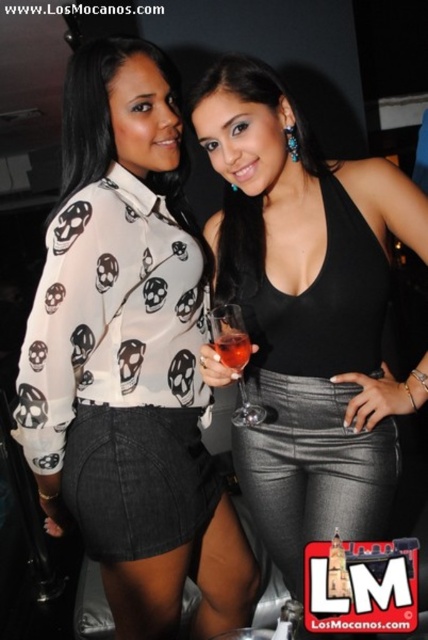
Can you confirm if white sheer blouse at upper left is smaller than shiny silver pants at center?

No, white sheer blouse at upper left is not smaller than shiny silver pants at center.

Is white sheer blouse at upper left thinner than shiny silver pants at center?

In fact, white sheer blouse at upper left might be wider than shiny silver pants at center.

The width and height of the screenshot is (428, 640). I want to click on white sheer blouse at upper left, so click(x=127, y=356).

Is point (104, 461) positioned in front of point (219, 323)?

No.

Which of these two, white sheer blouse at upper left or translucent glass wine glass at center, stands taller?

Standing taller between the two is white sheer blouse at upper left.

Measure the distance between white sheer blouse at upper left and camera.

1.02 meters

You are a GUI agent. You are given a task and a screenshot of the screen. Output one action in this format:
    pyautogui.click(x=<x>, y=<y>)
    Task: Click on the white sheer blouse at upper left
    Image resolution: width=428 pixels, height=640 pixels.
    Given the screenshot: What is the action you would take?
    pyautogui.click(x=127, y=356)

Between white sheer blouse at upper left and translucent glass at center, which one has less height?

With less height is translucent glass at center.

Locate an element on the screen. white sheer blouse at upper left is located at coordinates (127, 356).